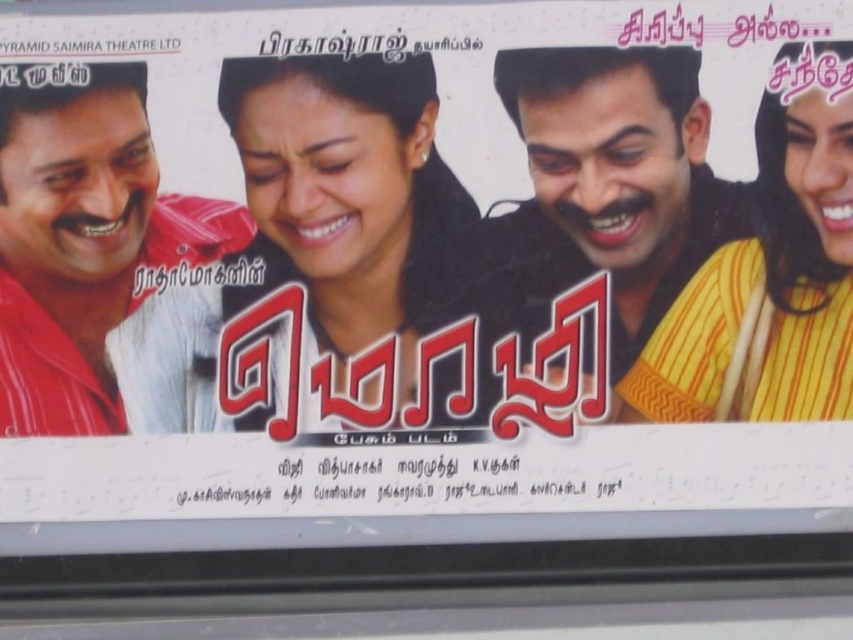
You are a photographer standing in front of the movie poster. You want to take a closeup shot of both the yellow striped shirt at right and the matte red shirt at left. Considering the camera you have can only focus on objects within a 1.2 meter range, will you be able to capture both shirts in focus?

The yellow striped shirt at right and the matte red shirt at left are 1.19 meters apart, which is within the camera focus range of 1.2 meters. Therefore, you can capture both shirts in focus.

Based on the movie poster described, which object is shorter between the matte red shirt at left and the yellow striped sari at right?

The matte red shirt at left is shorter than the yellow striped sari at right.